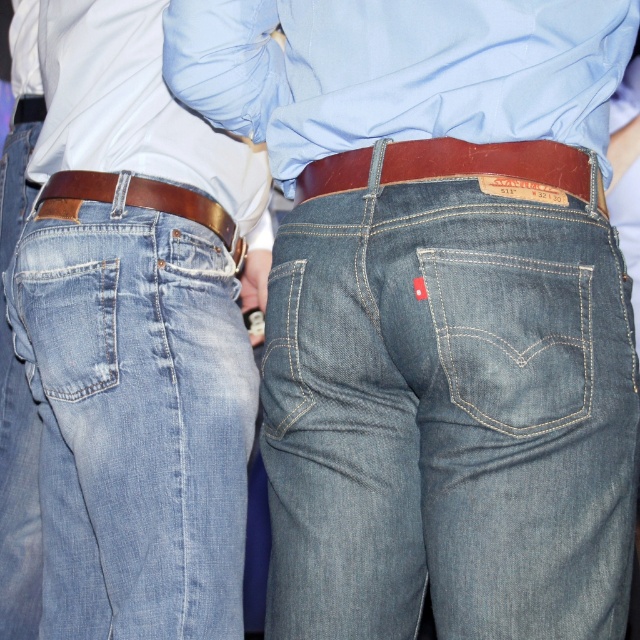
Question: Can you confirm if light blue cotton dress shirt at center is positioned to the left of light blue denim jeans at left?

Choices:
 (A) yes
 (B) no

Answer: (B)

Question: Among these points, which one is nearest to the camera?

Choices:
 (A) tap(256, 209)
 (B) tap(484, 372)
 (C) tap(204, 525)
 (D) tap(632, 515)

Answer: (B)

Question: Based on their relative distances, which object is nearer to the brown leather belt at left?

Choices:
 (A) white cotton dress shirt at upper center
 (B) denim pocket at lower left

Answer: (A)

Question: Which point is farther from the camera taking this photo?

Choices:
 (A) [333, 173]
 (B) [124, 29]

Answer: (B)

Question: Is denim at center to the right of brown leather belt at left from the viewer's perspective?

Choices:
 (A) no
 (B) yes

Answer: (B)

Question: Is light blue denim jeans at center above brown leather belt at center?

Choices:
 (A) no
 (B) yes

Answer: (A)